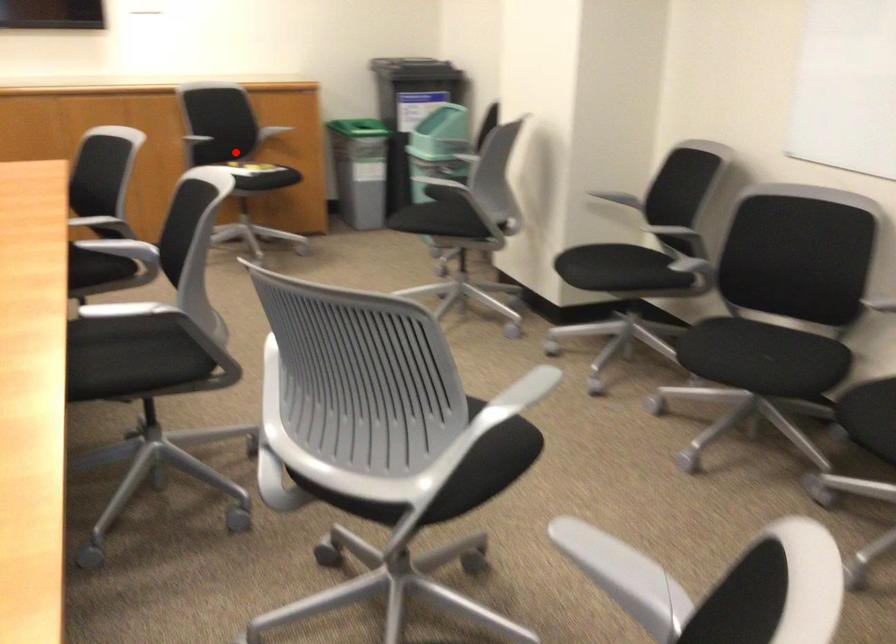
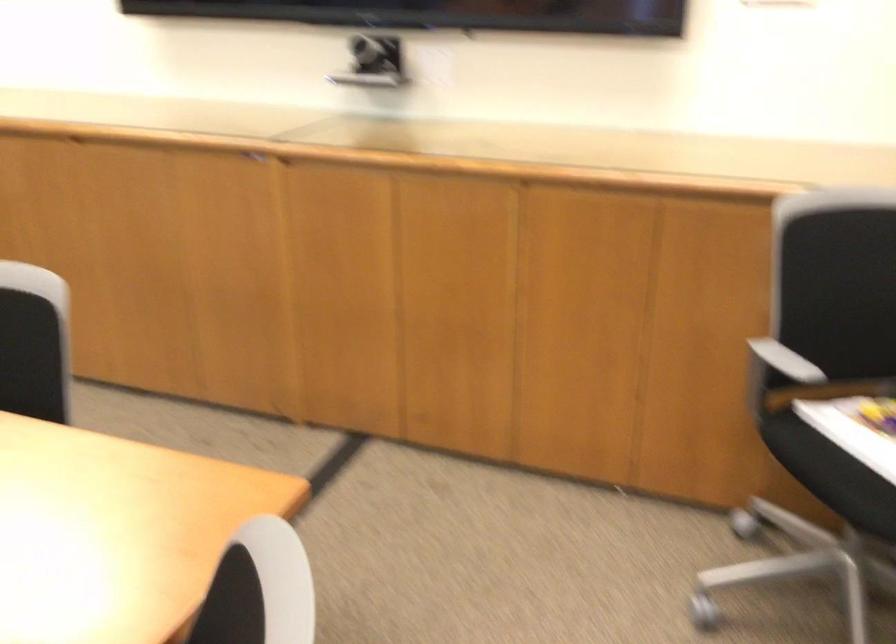
Question: I am providing you with two images of the same scene from different viewpoints. A red point is shown in image1. For the corresponding object point in image2, is it positioned nearer or farther from the camera?

Choices:
 (A) Nearer
 (B) Farther

Answer: (A)